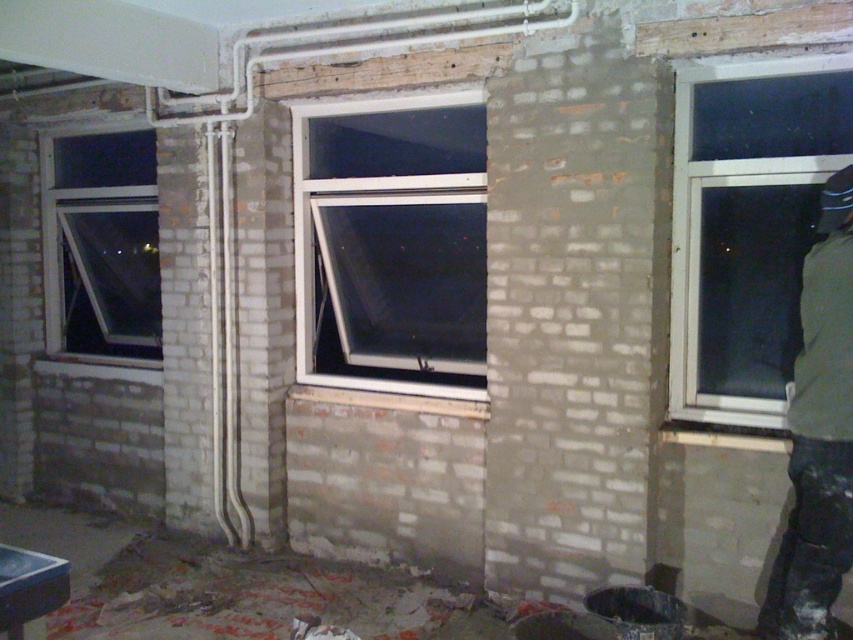
Question: Is clear glass window at upper right positioned in front of clear glass window at left?

Choices:
 (A) yes
 (B) no

Answer: (A)

Question: Among these objects, which one is farthest from the camera?

Choices:
 (A) clear glass window at upper right
 (B) green fabric jacket at right
 (C) white plastic window at center
 (D) clear glass window at left

Answer: (D)

Question: In this image, where is white plastic window at center located relative to green fabric jacket at right?

Choices:
 (A) left
 (B) right

Answer: (A)

Question: Estimate the real-world distances between objects in this image. Which object is closer to the green fabric jacket at right?

Choices:
 (A) white plastic window at center
 (B) clear glass window at left

Answer: (A)

Question: Among these objects, which one is farthest from the camera?

Choices:
 (A) clear glass window at upper right
 (B) green fabric jacket at right
 (C) clear glass window at left

Answer: (C)

Question: Considering the relative positions of clear glass window at upper right and green fabric jacket at right in the image provided, where is clear glass window at upper right located with respect to green fabric jacket at right?

Choices:
 (A) right
 (B) left

Answer: (B)